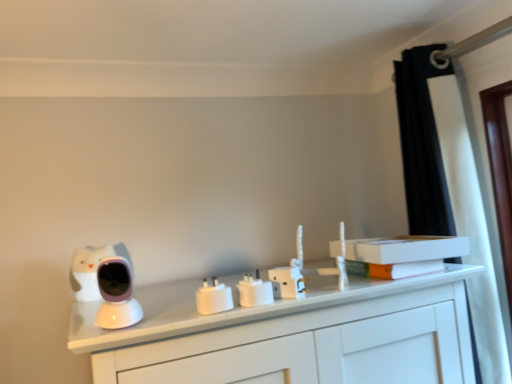
In the scene shown: How much space does white matte book at upper right, placed as the second book when sorted from bottom to top, occupy horizontally?

13.10 centimeters.

What do you see at coordinates (405, 249) in the screenshot? The height and width of the screenshot is (384, 512). I see `white matte book at upper right, placed as the second book when sorted from bottom to top` at bounding box center [405, 249].

The width and height of the screenshot is (512, 384). What do you see at coordinates (422, 144) in the screenshot?
I see `black fabric curtain at upper right` at bounding box center [422, 144].

Consider the image. What is the approximate height of white plastic electric outlet at center, the 3th electric outlet in the left-to-right sequence?

2.52 inches.

Measure the distance between point [78,262] and camera.

The distance of point [78,262] from camera is 1.16 meters.

The image size is (512, 384). I want to click on white matte book at upper right, placed as the 1th book when sorted from top to bottom, so click(405, 249).

Who is shorter, white plastic electric outlet at center, the second electric outlet in the right-to-left sequence, or white plastic electric outlet at center, which is counted as the 1th electric outlet, starting from the right?

white plastic electric outlet at center, the second electric outlet in the right-to-left sequence, is shorter.

Considering the sizes of objects white plastic electric outlet at center, the second electric outlet in the right-to-left sequence, and white plastic electric outlet at center, the 3th electric outlet in the left-to-right sequence, in the image provided, who is smaller, white plastic electric outlet at center, the second electric outlet in the right-to-left sequence, or white plastic electric outlet at center, the 3th electric outlet in the left-to-right sequence,?

white plastic electric outlet at center, the second electric outlet in the right-to-left sequence.

Which object is further away from the camera, white plastic electric outlet at center, the second electric outlet in the right-to-left sequence, or white plastic electric outlet at center, the 3th electric outlet in the left-to-right sequence?

white plastic electric outlet at center, the 3th electric outlet in the left-to-right sequence, is further from the camera.

Could you tell me if white plastic electric outlet at center, the second electric outlet from the left, is turned towards white plastic electric outlet at center, which is counted as the 1th electric outlet, starting from the right?

No, white plastic electric outlet at center, the second electric outlet from the left, is not facing towards white plastic electric outlet at center, which is counted as the 1th electric outlet, starting from the right.

Considering the points (446, 252) and (292, 276), which point is in front, point (446, 252) or point (292, 276)?

Positioned in front is point (292, 276).

Considering the positions of objects white matte book at upper right, placed as the second book when sorted from bottom to top, and white plastic electric outlet at center, which is counted as the 1th electric outlet, starting from the right, in the image provided, who is more to the left, white matte book at upper right, placed as the second book when sorted from bottom to top, or white plastic electric outlet at center, which is counted as the 1th electric outlet, starting from the right,?

Positioned to the left is white plastic electric outlet at center, which is counted as the 1th electric outlet, starting from the right.

Is white matte book at upper right, placed as the 1th book when sorted from top to bottom, bigger or smaller than white plastic electric outlet at center, the 3th electric outlet in the left-to-right sequence?

In the image, white matte book at upper right, placed as the 1th book when sorted from top to bottom, appears to be larger than white plastic electric outlet at center, the 3th electric outlet in the left-to-right sequence.

From a real-world perspective, is white matte book at upper right, placed as the 1th book when sorted from top to bottom, below white plastic electric outlet at center, the 3th electric outlet in the left-to-right sequence?

No, from a real-world perspective, white matte book at upper right, placed as the 1th book when sorted from top to bottom, is not beneath white plastic electric outlet at center, the 3th electric outlet in the left-to-right sequence.

Is orange matte book at upper right, which is the 2th book in top-to-bottom order, further to camera compared to purple glossy baby monitor at left?

Yes.

Is orange matte book at upper right, which is the 2th book in top-to-bottom order, next to purple glossy baby monitor at left and touching it?

No, orange matte book at upper right, which is the 2th book in top-to-bottom order, is not in contact with purple glossy baby monitor at left.

How different are the orientations of orange matte book at upper right, which is the 2th book in top-to-bottom order, and purple glossy baby monitor at left in degrees?

The angular difference between orange matte book at upper right, which is the 2th book in top-to-bottom order, and purple glossy baby monitor at left is 0.00654 degrees.

Based on the photo, does orange matte book at upper right, acting as the 1th book starting from the bottom, have a lesser height compared to purple glossy baby monitor at left?

Yes, orange matte book at upper right, acting as the 1th book starting from the bottom, is shorter than purple glossy baby monitor at left.

Which point is more forward, (108, 261) or (291, 274)?

Positioned in front is point (108, 261).

Between purple glossy baby monitor at left and white plastic electric outlet at center, the 3th electric outlet in the left-to-right sequence, which one appears on the right side from the viewer's perspective?

Positioned to the right is white plastic electric outlet at center, the 3th electric outlet in the left-to-right sequence.

Looking at this image, can you confirm if purple glossy baby monitor at left is thinner than white plastic electric outlet at center, the 3th electric outlet in the left-to-right sequence?

No.

Does purple glossy baby monitor at left have a smaller size compared to white plastic electric outlet at center, which is counted as the 1th electric outlet, starting from the right?

Actually, purple glossy baby monitor at left might be larger than white plastic electric outlet at center, which is counted as the 1th electric outlet, starting from the right.

Considering their positions, is white matte book at upper right, placed as the second book when sorted from bottom to top, located in front of or behind black fabric curtain at upper right?

white matte book at upper right, placed as the second book when sorted from bottom to top, is behind black fabric curtain at upper right.

Does white matte book at upper right, placed as the 1th book when sorted from top to bottom, have a greater height compared to black fabric curtain at upper right?

No, white matte book at upper right, placed as the 1th book when sorted from top to bottom, is not taller than black fabric curtain at upper right.

Does white matte book at upper right, placed as the second book when sorted from bottom to top, turn towards black fabric curtain at upper right?

No, white matte book at upper right, placed as the second book when sorted from bottom to top, is not facing towards black fabric curtain at upper right.

How many degrees apart are the facing directions of white matte book at upper right, placed as the 1th book when sorted from top to bottom, and black fabric curtain at upper right?

They differ by 85.9 degrees in their facing directions.

Does white plastic power adapter at center, which is the 1th electric outlet from left to right, have a lesser width compared to orange matte book at upper right, acting as the 1th book starting from the bottom?

Indeed, white plastic power adapter at center, which is the 1th electric outlet from left to right, has a lesser width compared to orange matte book at upper right, acting as the 1th book starting from the bottom.

Which of these two, white plastic power adapter at center, which is the third electric outlet in right-to-left order, or orange matte book at upper right, which is the 2th book in top-to-bottom order, is smaller?

With smaller size is white plastic power adapter at center, which is the third electric outlet in right-to-left order.

Is white plastic power adapter at center, which is the third electric outlet in right-to-left order, not inside orange matte book at upper right, acting as the 1th book starting from the bottom?

white plastic power adapter at center, which is the third electric outlet in right-to-left order, lies outside orange matte book at upper right, acting as the 1th book starting from the bottom,'s area.

Which is in front, white plastic electric outlet at center, the 3th electric outlet in the left-to-right sequence, or purple glossy baby monitor at left?

purple glossy baby monitor at left is more forward.

Considering the sizes of objects white plastic electric outlet at center, the 3th electric outlet in the left-to-right sequence, and purple glossy baby monitor at left in the image provided, who is taller, white plastic electric outlet at center, the 3th electric outlet in the left-to-right sequence, or purple glossy baby monitor at left?

Standing taller between the two is purple glossy baby monitor at left.

Is white plastic electric outlet at center, the 3th electric outlet in the left-to-right sequence, oriented away from purple glossy baby monitor at left?

No, white plastic electric outlet at center, the 3th electric outlet in the left-to-right sequence,'s orientation is not away from purple glossy baby monitor at left.

Which is closer, (302, 275) or (119, 274)?

Point (302, 275).

From the image's perspective, starting from the white plastic electric outlet at center, which is counted as the 1th electric outlet, starting from the right, which electric outlet is the 1st one below? Please provide its 2D coordinates.

[(254, 291)]

What are the coordinates of `book located above the white plastic electric outlet at center, the 3th electric outlet in the left-to-right sequence (from a real-world perspective)` in the screenshot? It's located at (405, 249).

Consider the image. Considering their positions, is orange matte book at upper right, acting as the 1th book starting from the bottom, positioned further to white matte book at upper right, placed as the second book when sorted from bottom to top, than white plastic electric outlet at center, the second electric outlet from the left?

white plastic electric outlet at center, the second electric outlet from the left.

From the image, which object appears to be farther from purple glossy baby monitor at left, white matte book at upper right, placed as the second book when sorted from bottom to top, or white plastic electric outlet at center, which is counted as the 1th electric outlet, starting from the right?

The object further to purple glossy baby monitor at left is white matte book at upper right, placed as the second book when sorted from bottom to top.

Considering their positions, is purple glossy baby monitor at left positioned closer to white matte book at upper right, placed as the second book when sorted from bottom to top, than white plastic electric outlet at center, the second electric outlet from the left?

Based on the image, white plastic electric outlet at center, the second electric outlet from the left, appears to be nearer to white matte book at upper right, placed as the second book when sorted from bottom to top.

Considering their positions, is white matte book at upper right, placed as the second book when sorted from bottom to top, positioned closer to white plastic electric outlet at center, the 3th electric outlet in the left-to-right sequence, than white plastic power adapter at center, which is the 1th electric outlet from left to right?

white plastic power adapter at center, which is the 1th electric outlet from left to right, lies closer to white plastic electric outlet at center, the 3th electric outlet in the left-to-right sequence, than the other object.

Considering their positions, is orange matte book at upper right, acting as the 1th book starting from the bottom, positioned closer to white plastic power adapter at center, which is the third electric outlet in right-to-left order, than black fabric curtain at upper right?

orange matte book at upper right, acting as the 1th book starting from the bottom.

Which object lies further to the anchor point white plastic power adapter at center, which is the 1th electric outlet from left to right, purple glossy baby monitor at left or white plastic electric outlet at center, the second electric outlet from the left?

The object further to white plastic power adapter at center, which is the 1th electric outlet from left to right, is purple glossy baby monitor at left.

Based on their spatial positions, is purple glossy baby monitor at left or orange matte book at upper right, acting as the 1th book starting from the bottom, closer to white plastic electric outlet at center, the second electric outlet in the right-to-left sequence?

Among the two, orange matte book at upper right, acting as the 1th book starting from the bottom, is located nearer to white plastic electric outlet at center, the second electric outlet in the right-to-left sequence.

Which object lies further to the anchor point orange matte book at upper right, which is the 2th book in top-to-bottom order, black fabric curtain at upper right or white plastic electric outlet at center, which is counted as the 1th electric outlet, starting from the right?

black fabric curtain at upper right is further to orange matte book at upper right, which is the 2th book in top-to-bottom order.

Locate an element on the screen. electric outlet situated between purple glossy baby monitor at left and white plastic electric outlet at center, the second electric outlet in the right-to-left sequence, from left to right is located at coordinates (214, 297).

Where is `electric outlet located between white plastic electric outlet at center, the second electric outlet in the right-to-left sequence, and orange matte book at upper right, acting as the 1th book starting from the bottom, in the left-right direction`? Image resolution: width=512 pixels, height=384 pixels. electric outlet located between white plastic electric outlet at center, the second electric outlet in the right-to-left sequence, and orange matte book at upper right, acting as the 1th book starting from the bottom, in the left-right direction is located at coordinates (287, 282).

Identify the location of book between white plastic power adapter at center, which is the 1th electric outlet from left to right, and white matte book at upper right, placed as the 1th book when sorted from top to bottom, from left to right. (393, 269).

Where is `book located between white plastic electric outlet at center, the 3th electric outlet in the left-to-right sequence, and white matte book at upper right, placed as the second book when sorted from bottom to top, in the left-right direction`? book located between white plastic electric outlet at center, the 3th electric outlet in the left-to-right sequence, and white matte book at upper right, placed as the second book when sorted from bottom to top, in the left-right direction is located at coordinates (393, 269).